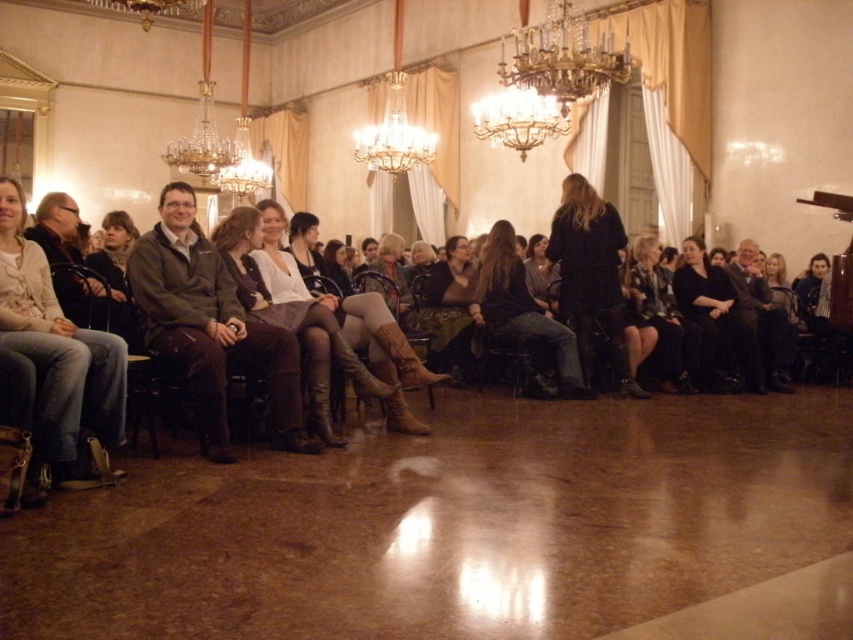
You are a photographer standing at the back of the room. You need to capture a photo that includes both the jeans at left and the green textured skirt at center. Given the distance between them, will you need to adjust your camera to a wider angle to ensure both are in the frame?

The jeans at left and green textured skirt at center are 11.72 feet apart. To capture both in the same frame, you would need to adjust your camera to a wider angle to accommodate the distance between them.